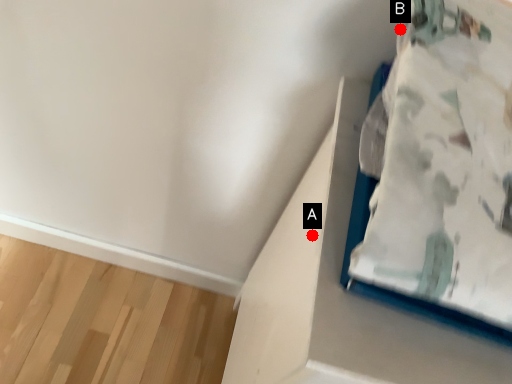
Question: Two points are circled on the image, labeled by A and B beside each circle. Among these points, which one is farthest from the camera?

Choices:
 (A) A is further
 (B) B is further

Answer: (A)